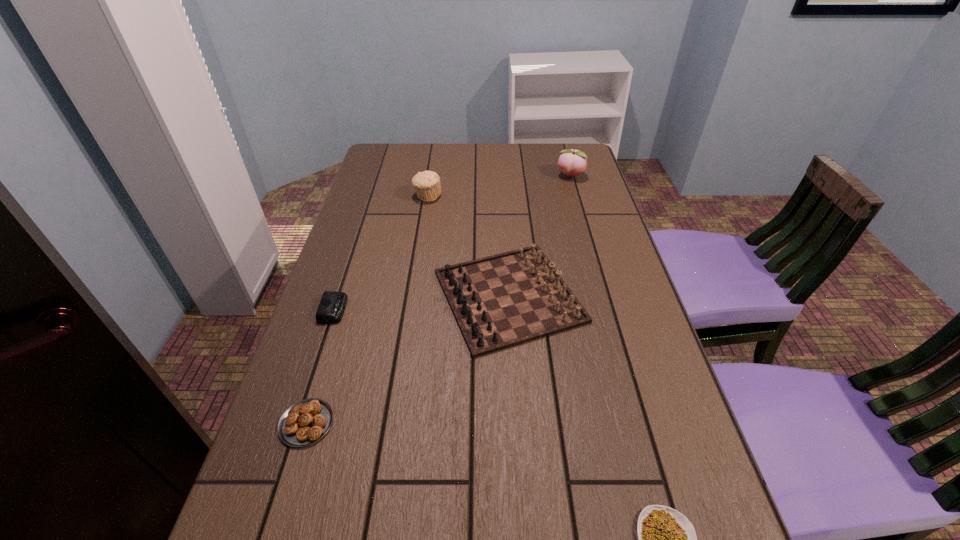
Locate an element on the screen. The width and height of the screenshot is (960, 540). vacant area at the right edge of the desktop is located at coordinates (577, 242).

You are a GUI agent. You are given a task and a screenshot of the screen. Output one action in this format:
    pyautogui.click(x=<x>, y=<y>)
    Task: Click on the free space at the far left corner of the desktop
    
    Given the screenshot: What is the action you would take?
    pyautogui.click(x=412, y=146)

Locate an element on the screen. free space between the chessboard and the farthest object is located at coordinates (540, 236).

This screenshot has height=540, width=960. Identify the location of vacant space that is in between the tallest object and the pastry. pyautogui.click(x=438, y=300).

Where is `free space between the pastry and the tallest object`? Image resolution: width=960 pixels, height=540 pixels. free space between the pastry and the tallest object is located at coordinates (438, 300).

Locate an element on the screen. empty space between the second nearest object and the chessboard is located at coordinates click(x=408, y=360).

Identify the location of vacant space that's between the chessboard and the tallest object. This screenshot has width=960, height=540. (540, 236).

The height and width of the screenshot is (540, 960). In order to click on vacant area that lies between the farthest object and the fifth farthest object in this screenshot , I will do `click(438, 300)`.

This screenshot has height=540, width=960. Identify the location of object identified as the third closest to the shortest object. (332, 305).

Select which object is the second closest to the third tallest object. Please provide its 2D coordinates. Your answer should be formatted as a tuple, i.e. [(x, y)], where the tuple contains the x and y coordinates of a point satisfying the conditions above.

[(332, 305)]